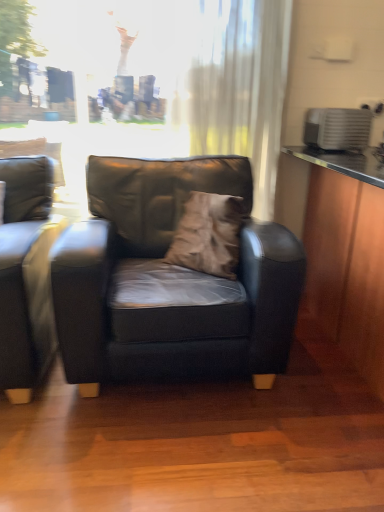
Question: Is white sheer curtain at upper center to the left of matte black couch at left from the viewer's perspective?

Choices:
 (A) yes
 (B) no

Answer: (B)

Question: Considering the relative sizes of white sheer curtain at upper center and matte black couch at left in the image provided, is white sheer curtain at upper center smaller than matte black couch at left?

Choices:
 (A) no
 (B) yes

Answer: (B)

Question: Is white sheer curtain at upper center taller than matte black couch at left?

Choices:
 (A) no
 (B) yes

Answer: (B)

Question: Can you confirm if white sheer curtain at upper center is shorter than matte black couch at left?

Choices:
 (A) yes
 (B) no

Answer: (B)

Question: Are white sheer curtain at upper center and matte black couch at left beside each other?

Choices:
 (A) no
 (B) yes

Answer: (A)

Question: Is white sheer curtain at upper center completely or partially outside of matte black couch at left?

Choices:
 (A) no
 (B) yes

Answer: (B)

Question: Would you say brown suede pillow at center is outside white sheer curtain at upper center?

Choices:
 (A) no
 (B) yes

Answer: (B)

Question: From the image's perspective, does brown suede pillow at center appear lower than white sheer curtain at upper center?

Choices:
 (A) no
 (B) yes

Answer: (B)

Question: From a real-world perspective, is brown suede pillow at center physically below white sheer curtain at upper center?

Choices:
 (A) no
 (B) yes

Answer: (B)

Question: Can you confirm if brown suede pillow at center is bigger than white sheer curtain at upper center?

Choices:
 (A) no
 (B) yes

Answer: (A)

Question: From the image's perspective, would you say brown suede pillow at center is positioned over white sheer curtain at upper center?

Choices:
 (A) yes
 (B) no

Answer: (B)

Question: Is brown suede pillow at center at the right side of white sheer curtain at upper center?

Choices:
 (A) yes
 (B) no

Answer: (B)

Question: From a real-world perspective, is brown suede pillow at center positioned under matte black chair at center based on gravity?

Choices:
 (A) no
 (B) yes

Answer: (A)